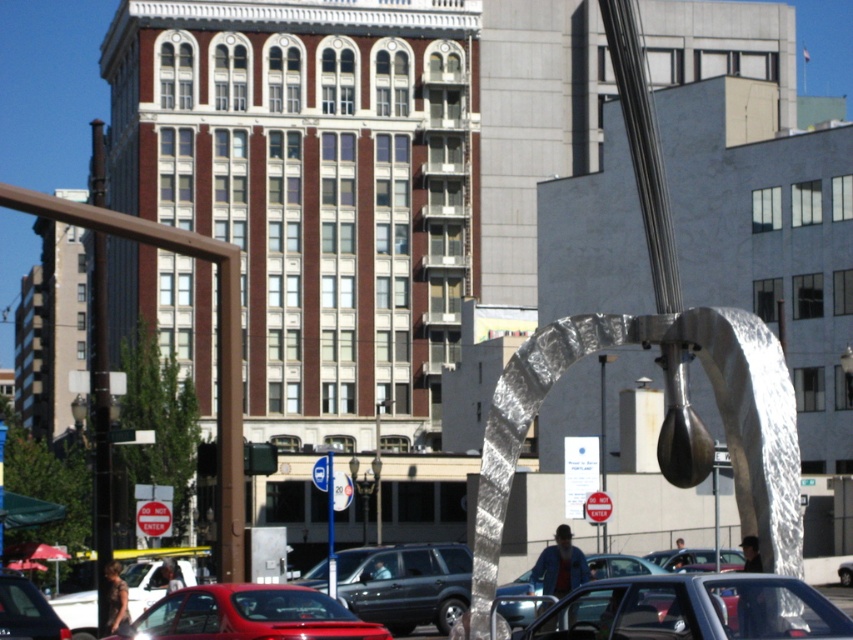
Can you confirm if metallic red car at lower center is smaller than matte red car at lower left?

Actually, metallic red car at lower center might be larger than matte red car at lower left.

Can you confirm if metallic red car at lower center is positioned to the left of matte red car at lower left?

In fact, metallic red car at lower center is to the right of matte red car at lower left.

Who is more forward, (x=306, y=598) or (x=74, y=637)?

Point (x=306, y=598) is in front.

I want to click on metallic red car at lower center, so click(248, 616).

Is matte black suv at center wider than metallic red car at lower left?

Indeed, matte black suv at center has a greater width compared to metallic red car at lower left.

Can you confirm if matte black suv at center is positioned to the left of metallic red car at lower left?

In fact, matte black suv at center is to the right of metallic red car at lower left.

Find the location of a particular element. matte black suv at center is located at coordinates (405, 582).

Describe the element at coordinates (662, 369) in the screenshot. I see `polished silver sculpture at center` at that location.

Is polished silver sculpture at center below metallic red car at lower left?

Incorrect, polished silver sculpture at center is not positioned below metallic red car at lower left.

Which is behind, point (776, 406) or point (15, 582)?

The point (15, 582) is behind.

Image resolution: width=853 pixels, height=640 pixels. I want to click on polished silver sculpture at center, so click(662, 369).